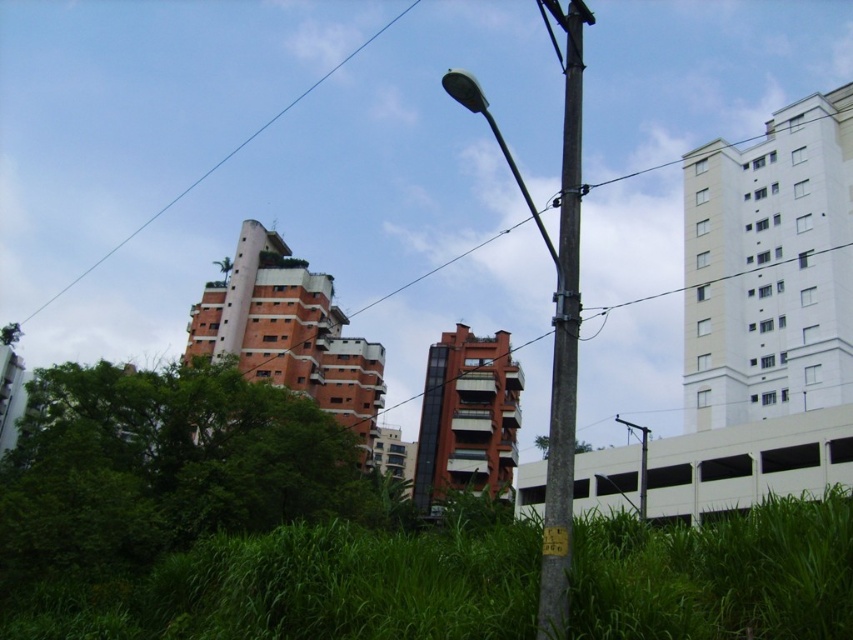
You are standing in the urban scene and want to take a photo. You notice two points marked in the image. Which point is closer to your camera? The points are point at (294, 106) and point at (543, 528).

Point at (294, 106) is closer to the camera because it is further to the camera than point at (543, 528).

You are a city planner reviewing this area. You need to install a new sensor that requires attaching it to either the blue wire at upper left or the yellow plastic street sign at lower center. Considering their sizes, which object would be more suitable for mounting the sensor?

The blue wire at upper left has a larger size compared to the yellow plastic street sign at lower center, so it would be more suitable for mounting the sensor as it can provide a sturdier and more stable attachment point.

You are a city planner assessing the spacing between the brown wooden telegraph pole at center and the yellow plastic street sign at lower center. According to the city regulations, the minimum required distance between such infrastructure elements is 50 feet. Based on the provided information, does this spacing comply with the regulations?

The distance between the brown wooden telegraph pole at center and the yellow plastic street sign at lower center is 48.14 feet, which is less than the required 50 feet. Therefore, this spacing does not comply with the city regulations.